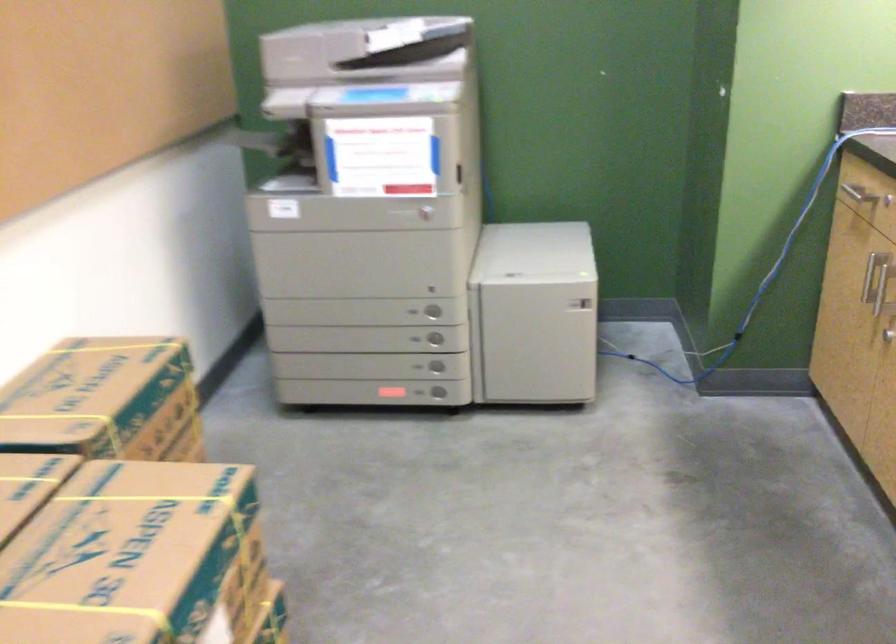
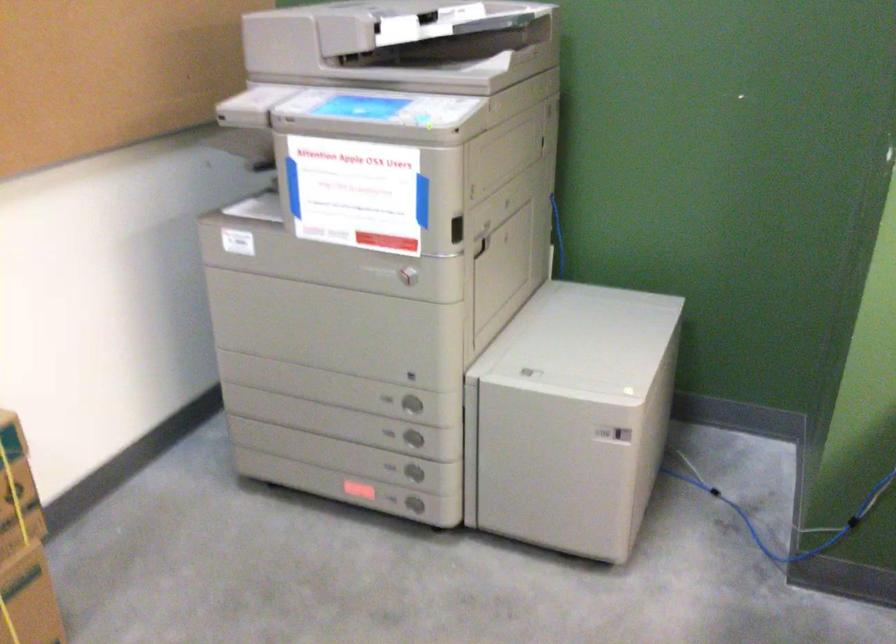
In the second image, find the point that corresponds to point 433,312 in the first image.

(411, 404)